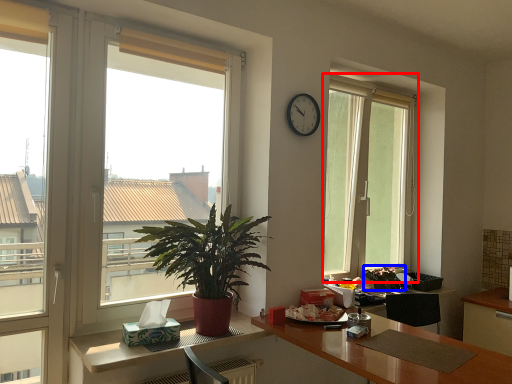
Question: Which object is closer to the camera taking this photo, window (highlighted by a red box) or houseplant (highlighted by a blue box)?

Choices:
 (A) window
 (B) houseplant

Answer: (A)